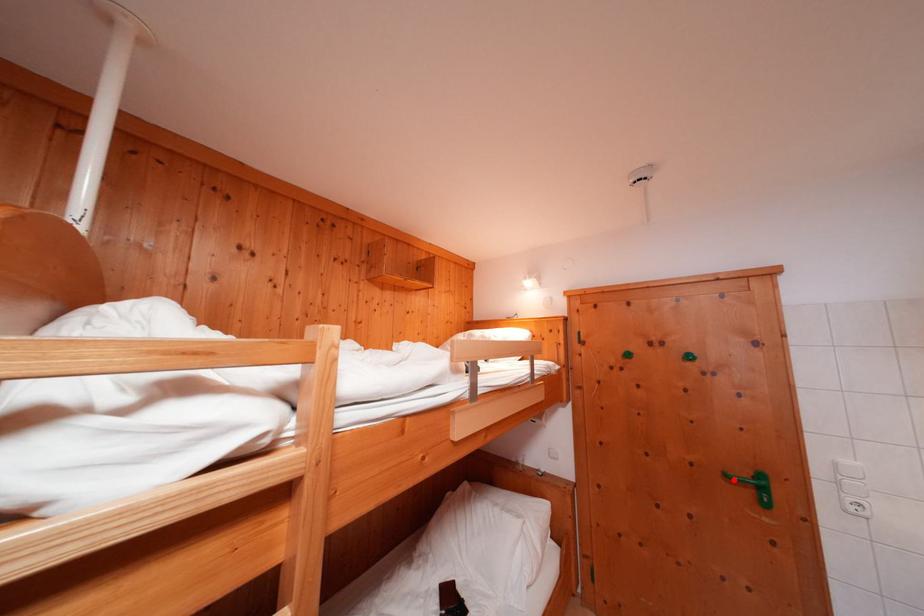
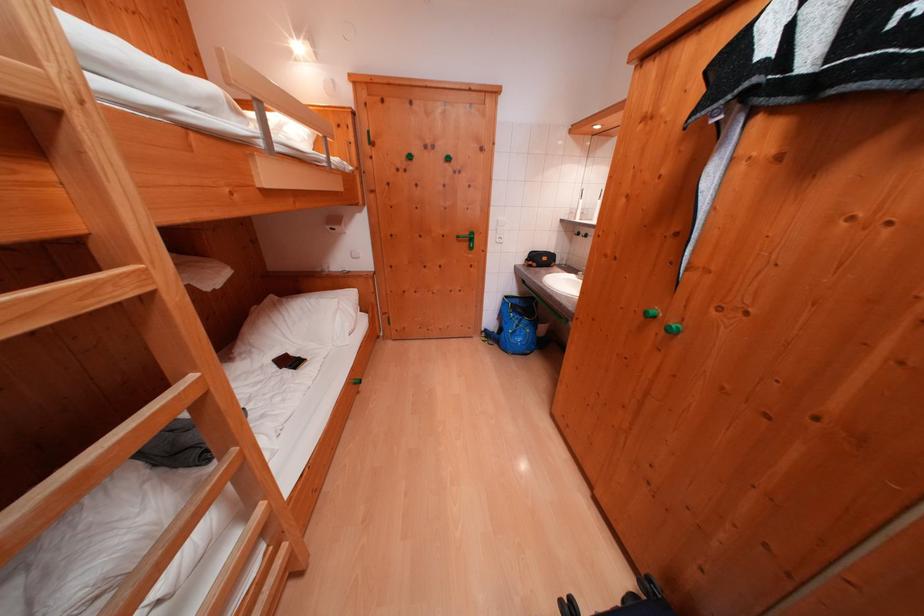
Question: I am providing you with two images of the same scene from different viewpoints. A red point is shown in image1. For the corresponding object point in image2, is it positioned nearer or farther from the camera?

Choices:
 (A) Nearer
 (B) Farther

Answer: (A)